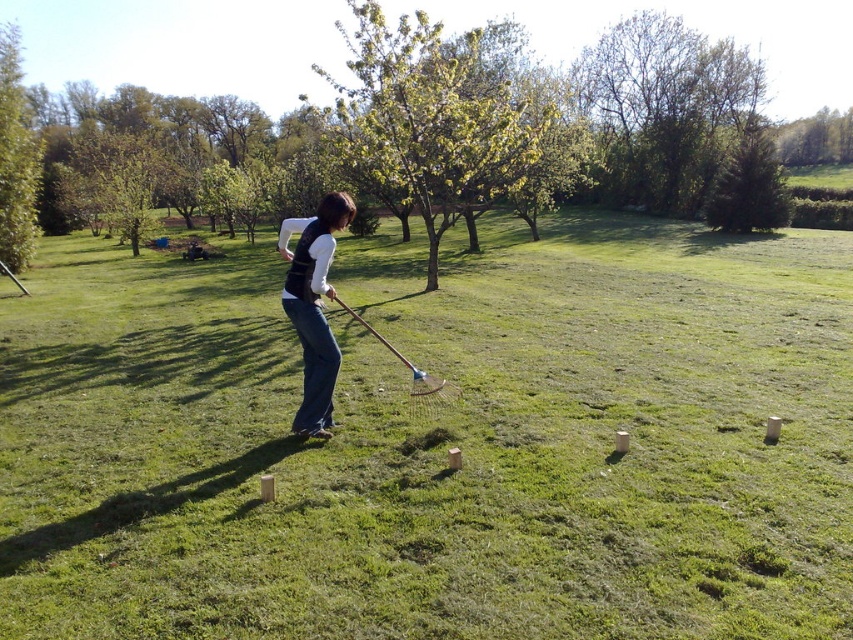
Question: Which of the following is the farthest from the observer?

Choices:
 (A) denim jeans at center
 (B) green grass at center

Answer: (A)

Question: Which object appears farthest from the camera in this image?

Choices:
 (A) green grass at center
 (B) denim jeans at center

Answer: (B)

Question: Can you confirm if green grass at center is thinner than denim jeans at center?

Choices:
 (A) yes
 (B) no

Answer: (B)

Question: Is green grass at center above denim jeans at center?

Choices:
 (A) yes
 (B) no

Answer: (A)

Question: Is green grass at center smaller than denim jeans at center?

Choices:
 (A) no
 (B) yes

Answer: (A)